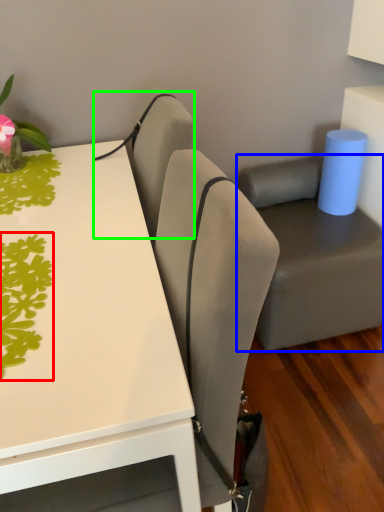
Question: Based on their relative distances, which object is farther from plant (highlighted by a red box)? Choose from swivel chair (highlighted by a blue box) and armchair (highlighted by a green box).

Choices:
 (A) swivel chair
 (B) armchair

Answer: (A)